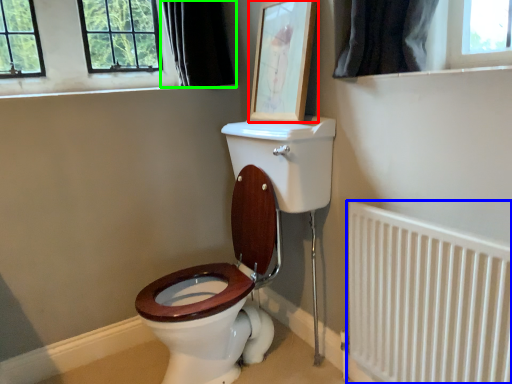
Question: Which object is positioned farthest from picture frame (highlighted by a red box)? Select from radiator (highlighted by a blue box) and curtain (highlighted by a green box).

Choices:
 (A) radiator
 (B) curtain

Answer: (A)